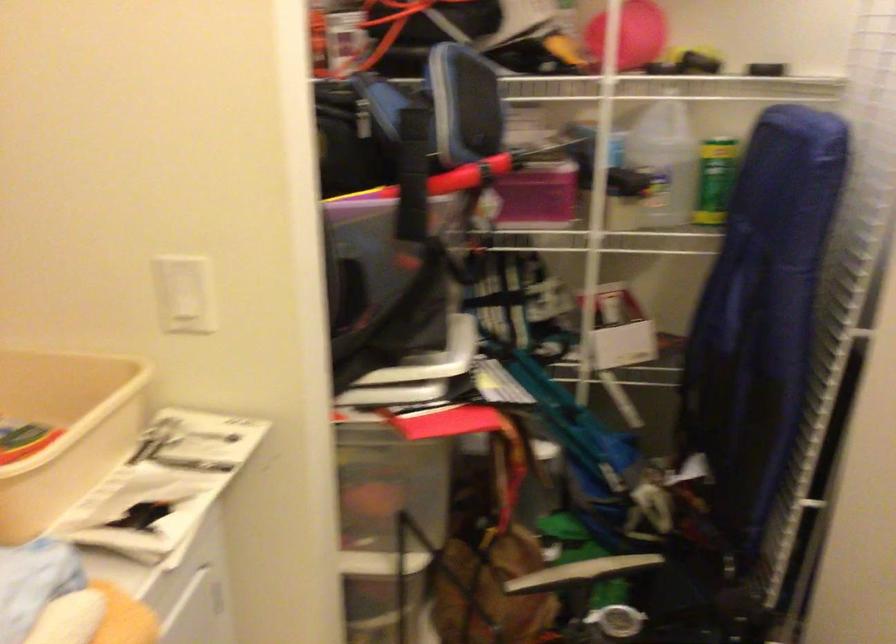
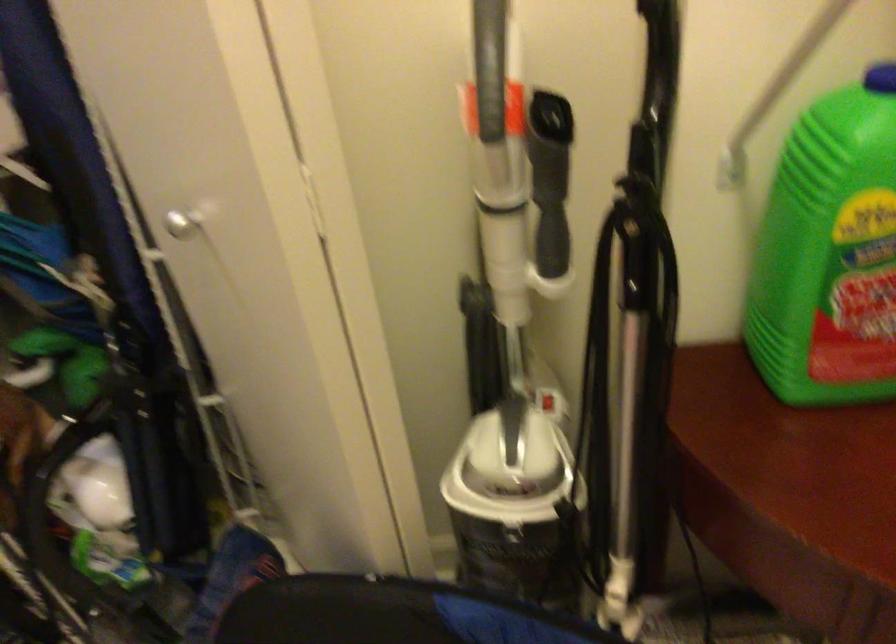
Based on the continuous images, in which direction is the camera rotating?

The camera rotated toward right-down.